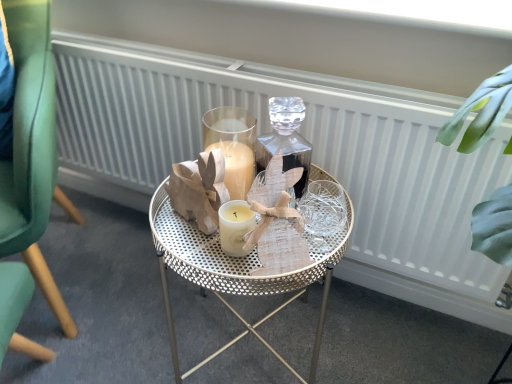
Where is `vacant region below green velvet chair at left (from a real-world perspective)`? vacant region below green velvet chair at left (from a real-world perspective) is located at coordinates (67, 256).